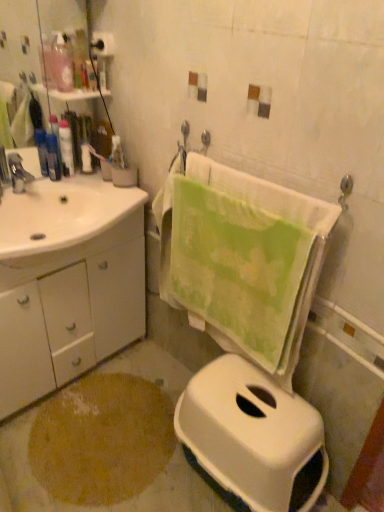
This screenshot has height=512, width=384. I want to click on vacant point to the right of matte silver faucet at left, so click(x=62, y=197).